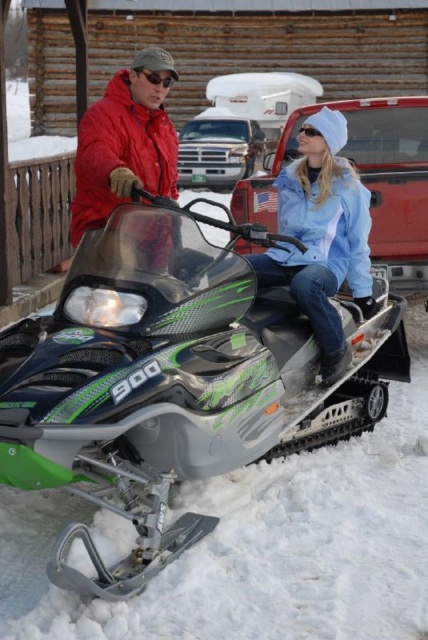
You are a photographer trying to capture a clear photo of the matte red jacket at upper left without the green matte snowmobile at center blocking it. Based on their positions, is this possible?

The green matte snowmobile at center is in front of the matte red jacket at upper left, so it is blocking the view. To capture a clear photo of the matte red jacket at upper left without the snowmobile blocking, you would need to move around to a different angle where the snowmobile is no longer in front.

You are a photographer trying to capture a photo of the two people in the snowy scene. You want to ensure both the matte red jacket at upper left and the black matte goggles at upper center are clearly visible in your shot. Based on their positions, which direction should you position yourself relative to the snowmobile to ensure both are in frame?

Since the matte red jacket at upper left is to the left of the black matte goggles at upper center, positioning yourself to the right side of the snowmobile would allow both objects to be visible in the frame.

Based on the coordinates provided, where is the light blue denim jacket at center located in the image?

The light blue denim jacket at center is located at the coordinates point (321,237).